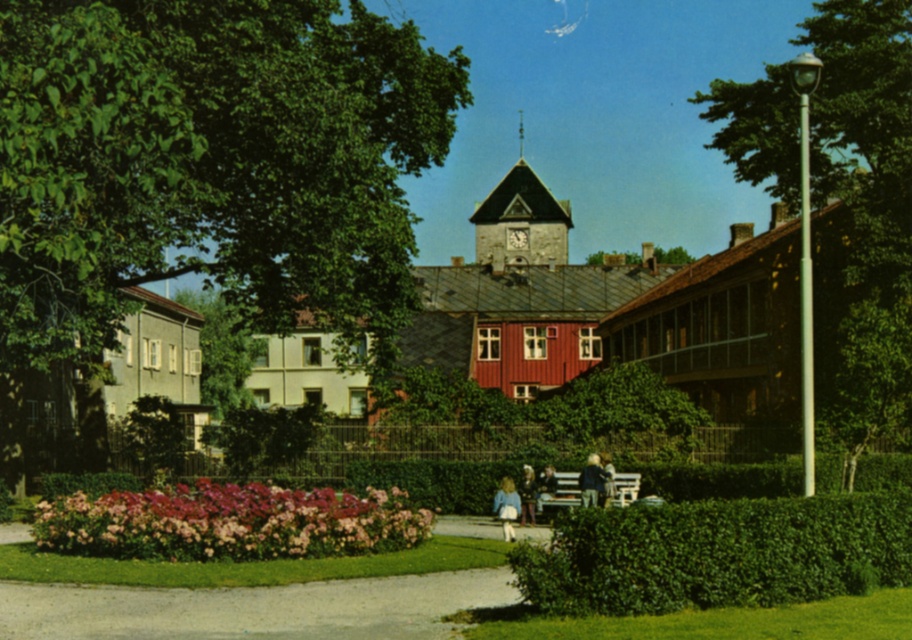
Does green leafy hedge at lower center have a greater width compared to light blue denim jacket at lower center?

Yes, green leafy hedge at lower center is wider than light blue denim jacket at lower center.

Which of these two, green leafy hedge at lower center or light blue denim jacket at lower center, stands taller?

green leafy hedge at lower center

Who is more distant from viewer, (752,604) or (511,500)?

Positioned behind is point (511,500).

The image size is (912, 640). Identify the location of green leafy hedge at lower center. (717, 554).

Is green leafy tree at upper left further to the viewer compared to blonde hair at bench right?

No, green leafy tree at upper left is closer to the viewer.

Between green leafy tree at upper left and blonde hair at bench right, which one is positioned higher?

green leafy tree at upper left is above.

What are the coordinates of `green leafy tree at upper left` in the screenshot? It's located at (209, 161).

The image size is (912, 640). Find the location of `green leafy tree at upper left`. green leafy tree at upper left is located at coordinates (209, 161).

Which of these two, green leafy tree at upper left or green leafy hedge at lower center, stands shorter?

green leafy hedge at lower center is shorter.

Who is more distant from viewer, (339, 198) or (819, 540)?

The point (339, 198) is behind.

I want to click on green leafy tree at upper left, so click(209, 161).